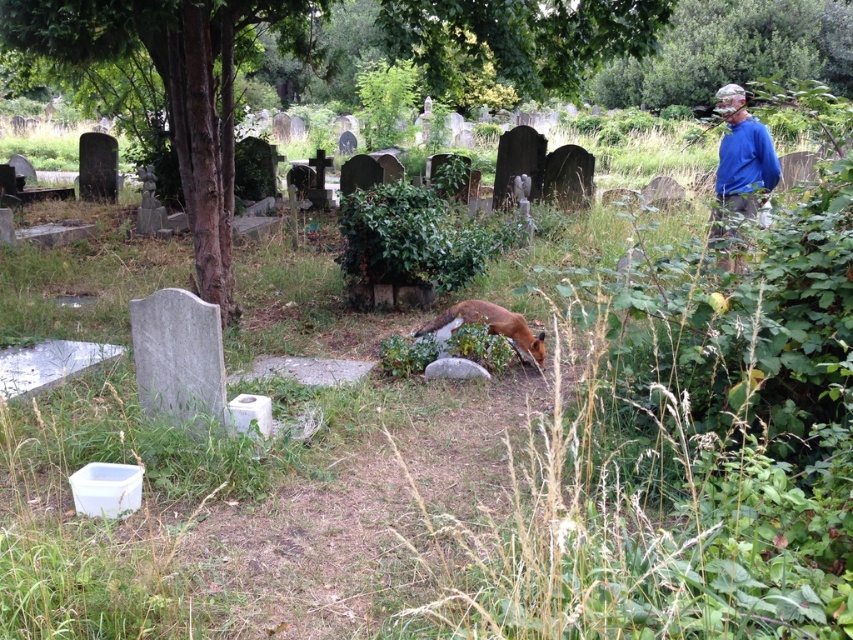
Which is above, brown textured tree at center or green leafy tree at upper right?

Positioned higher is green leafy tree at upper right.

Locate an element on the screen. The width and height of the screenshot is (853, 640). brown textured tree at center is located at coordinates (173, 86).

Locate an element on the screen. brown textured tree at center is located at coordinates (173, 86).

Between point (218, 285) and point (735, 92), which one is positioned in front?

Positioned in front is point (218, 285).

Who is positioned more to the left, brown textured tree at center or blue cotton shirt at upper right?

From the viewer's perspective, brown textured tree at center appears more on the left side.

Which is in front, point (442, 72) or point (769, 144)?

Positioned in front is point (769, 144).

Where is `brown textured tree at center`? The height and width of the screenshot is (640, 853). brown textured tree at center is located at coordinates (173, 86).

In the scene shown: Does green leafy tree at upper right have a lesser width compared to brown fur fox at center?

Incorrect, green leafy tree at upper right's width is not less than brown fur fox at center's.

Which is in front, point (643, 93) or point (430, 324)?

Point (430, 324) is in front.

The image size is (853, 640). What do you see at coordinates (733, 51) in the screenshot? I see `green leafy tree at upper right` at bounding box center [733, 51].

Identify the location of green leafy tree at upper right. The height and width of the screenshot is (640, 853). (733, 51).